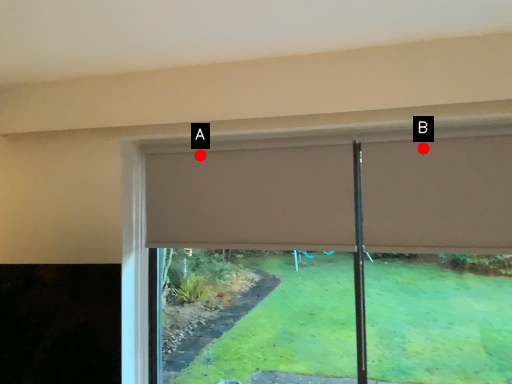
Question: Two points are circled on the image, labeled by A and B beside each circle. Which point is closer to the camera?

Choices:
 (A) A is closer
 (B) B is closer

Answer: (B)